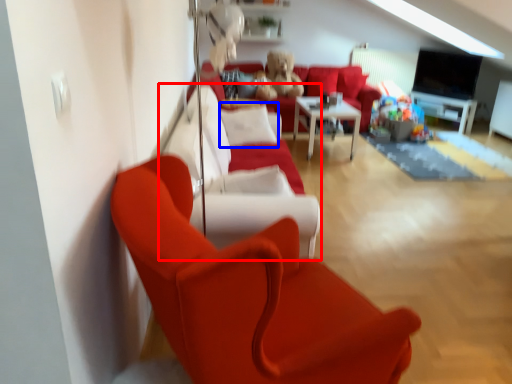
Question: Which of the following is the farthest to the observer, couch (highlighted by a red box) or pillow (highlighted by a blue box)?

Choices:
 (A) couch
 (B) pillow

Answer: (B)